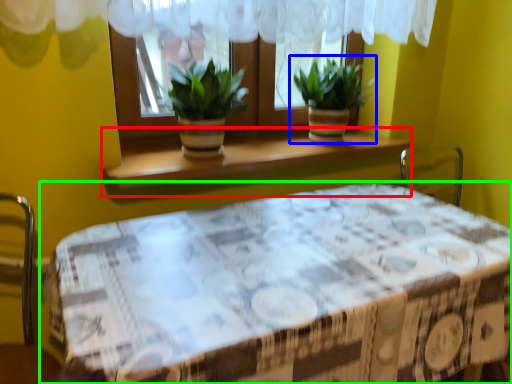
Question: Which object is the closest to the window sill (highlighted by a red box)? Choose among these: houseplant (highlighted by a blue box) or table (highlighted by a green box).

Choices:
 (A) houseplant
 (B) table

Answer: (A)